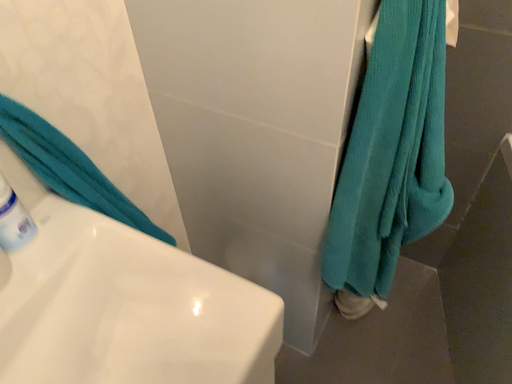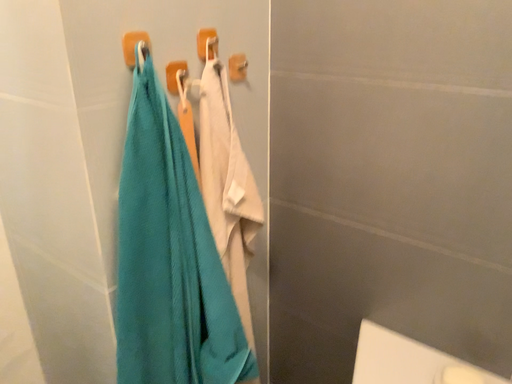
Question: How did the camera likely rotate when shooting the video?

Choices:
 (A) rotated downward
 (B) rotated upward

Answer: (B)